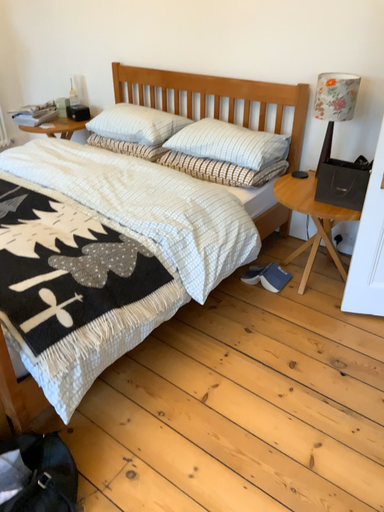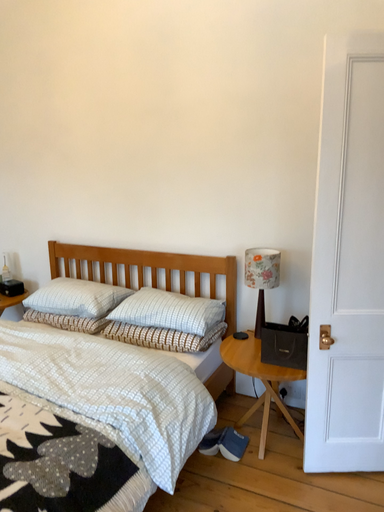
Question: How did the camera likely rotate when shooting the video?

Choices:
 (A) rotated upward
 (B) rotated downward

Answer: (A)